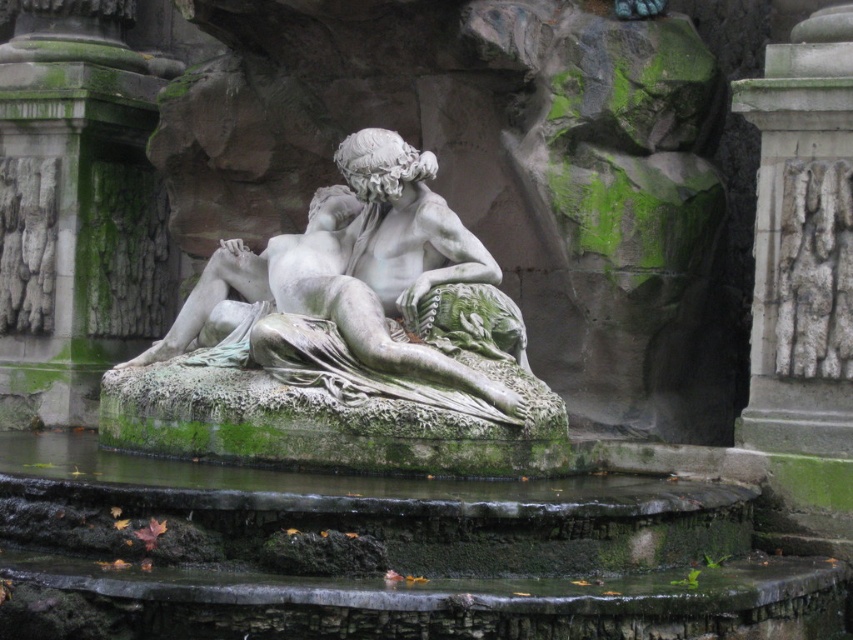
Question: Which point is closer to the camera?

Choices:
 (A) (186, 340)
 (B) (78, 248)
 (C) (788, 387)

Answer: (C)

Question: Is green mossy stone column at center below white marble statue at center?

Choices:
 (A) yes
 (B) no

Answer: (B)

Question: Is green mossy stone column at center positioned at the back of white stone carving at right?

Choices:
 (A) no
 (B) yes

Answer: (B)

Question: Among these points, which one is farthest from the camera?

Choices:
 (A) (787, 336)
 (B) (146, 300)
 (C) (457, 237)

Answer: (B)

Question: Is green mossy stone column at center in front of white stone carving at right?

Choices:
 (A) yes
 (B) no

Answer: (B)

Question: Which point is closer to the camera?

Choices:
 (A) green mossy stone column at center
 (B) white stone carving at right

Answer: (B)